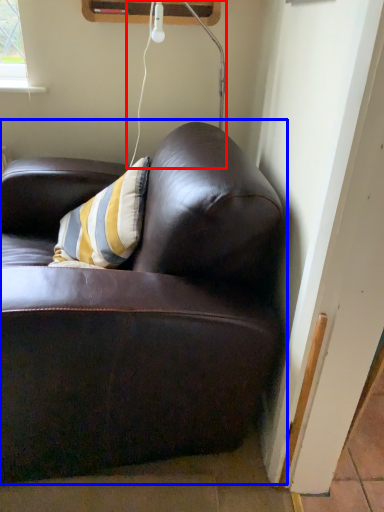
Question: Which object is closer to the camera taking this photo, lamp (highlighted by a red box) or studio couch (highlighted by a blue box)?

Choices:
 (A) lamp
 (B) studio couch

Answer: (B)